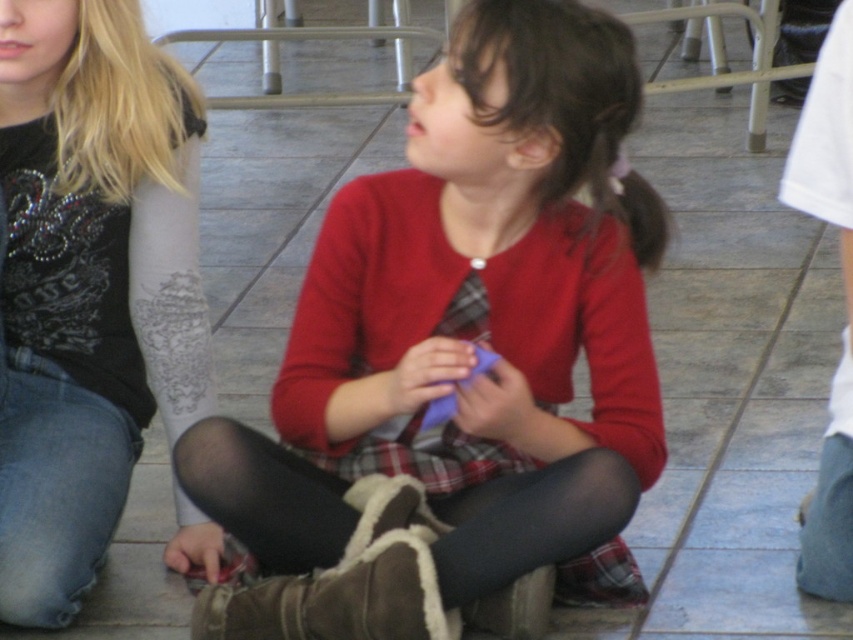
Question: Can you confirm if matte red sweater at center is positioned below matte black shirt at left?

Choices:
 (A) yes
 (B) no

Answer: (A)

Question: Can you confirm if matte red sweater at center is positioned to the left of matte black shirt at left?

Choices:
 (A) no
 (B) yes

Answer: (A)

Question: Which point is farther from the camera taking this photo?

Choices:
 (A) (543, 470)
 (B) (183, 81)

Answer: (B)

Question: Which point is closer to the camera?

Choices:
 (A) (611, 154)
 (B) (4, 49)

Answer: (A)

Question: Observing the image, what is the correct spatial positioning of matte red sweater at center in reference to matte black shirt at left?

Choices:
 (A) right
 (B) left

Answer: (A)